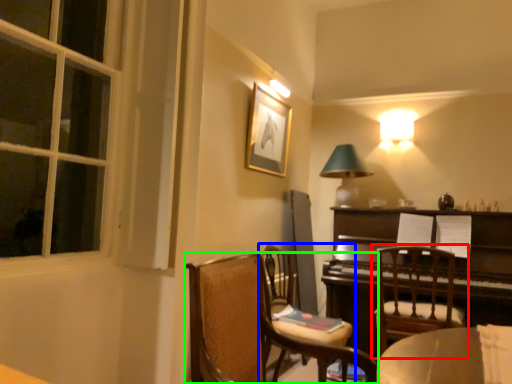
Question: Which is farther away from chair (highlighted by a red box)? chair (highlighted by a blue box) or chair (highlighted by a green box)?

Choices:
 (A) chair
 (B) chair

Answer: (B)